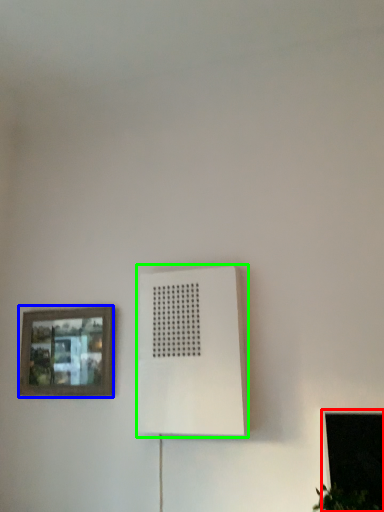
Question: Which object is the farthest from window (highlighted by a red box)? Choose among these: picture frame (highlighted by a blue box) or air conditioning (highlighted by a green box).

Choices:
 (A) picture frame
 (B) air conditioning

Answer: (A)